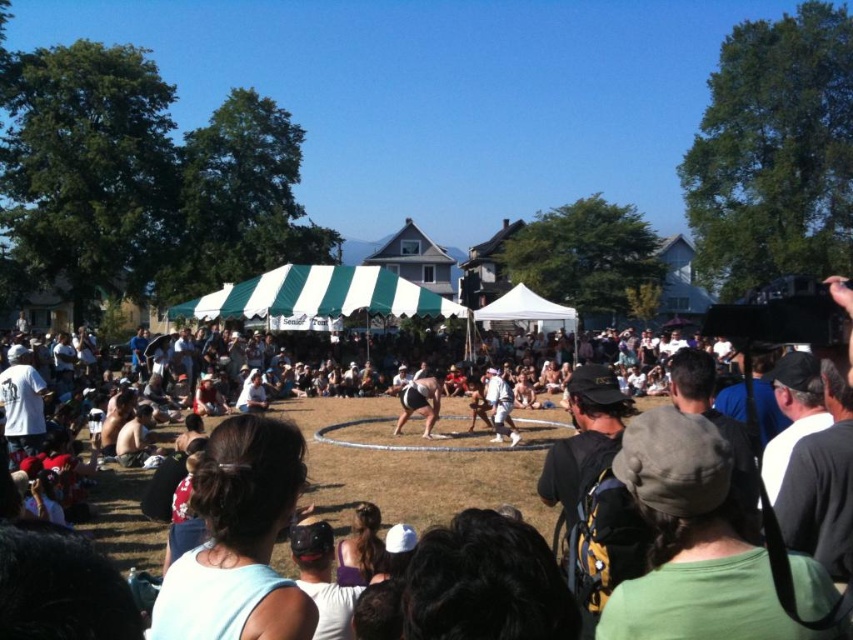
Can you confirm if green striped canopy at center is taller than black fabric sumo wrestler at center?

Yes.

Locate an element on the screen. Image resolution: width=853 pixels, height=640 pixels. green striped canopy at center is located at coordinates (318, 298).

Which is in front, point (265, 300) or point (437, 392)?

Point (437, 392) is in front.

Image resolution: width=853 pixels, height=640 pixels. In order to click on green striped canopy at center in this screenshot , I will do `click(318, 298)`.

Who is more distant from viewer, (509, 497) or (341, 266)?

Point (341, 266)

Based on the photo, who is positioned more to the left, dark gray fabric crowd at center or green striped canopy at center?

green striped canopy at center

Who is more forward, (282, 410) or (405, 305)?

Point (282, 410)

You are a GUI agent. You are given a task and a screenshot of the screen. Output one action in this format:
    pyautogui.click(x=<x>, y=<y>)
    Task: Click on the dark gray fabric crowd at center
    The width and height of the screenshot is (853, 640).
    Given the screenshot: What is the action you would take?
    pyautogui.click(x=416, y=461)

Who is positioned more to the left, dark gray fabric crowd at center or black fabric sumo wrestler at center?

black fabric sumo wrestler at center is more to the left.

Locate an element on the screen. This screenshot has height=640, width=853. dark gray fabric crowd at center is located at coordinates (416, 461).